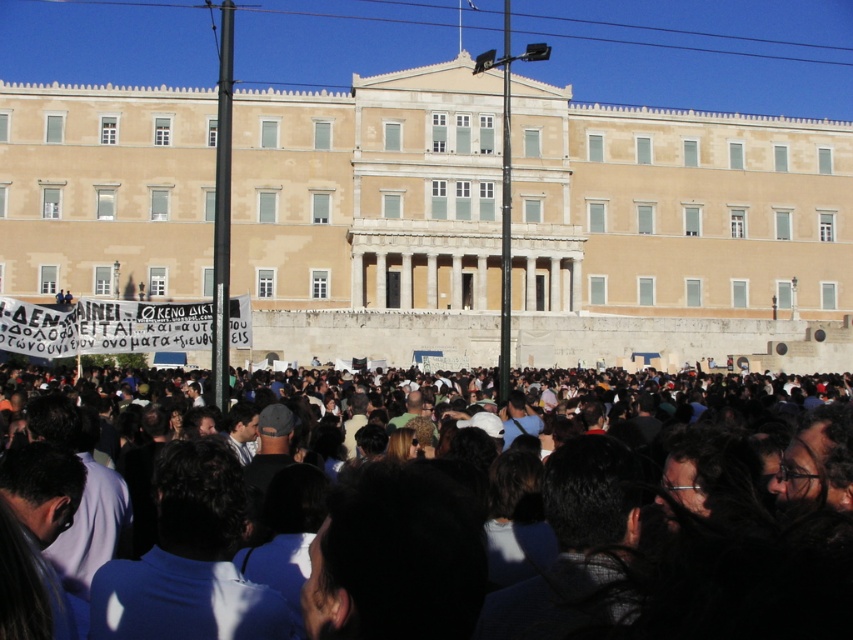
You are standing in the crowd at the event in front of the beige stone building at center and dark brown hair at center. Which object is positioned to the right of the other?

The beige stone building at center is positioned to the right of dark brown hair at center.

You are a photographer trying to capture the entire beige stone building at center and the dark brown hair at center in a single frame. Based on their widths, which object should you focus on to ensure both fit in the photo?

The beige stone building at center is wider than the dark brown hair at center. To capture both in a single frame, focus on the beige stone building at center as it occupies more space, allowing the narrower dark brown hair at center to fit alongside.

You are a photographer trying to capture a photo of the beige stone building at center and the dark brown hair at center from the same angle. Which object will appear bigger in your photo?

The beige stone building at center is larger in size than the dark brown hair at center, so it will appear bigger in the photo.